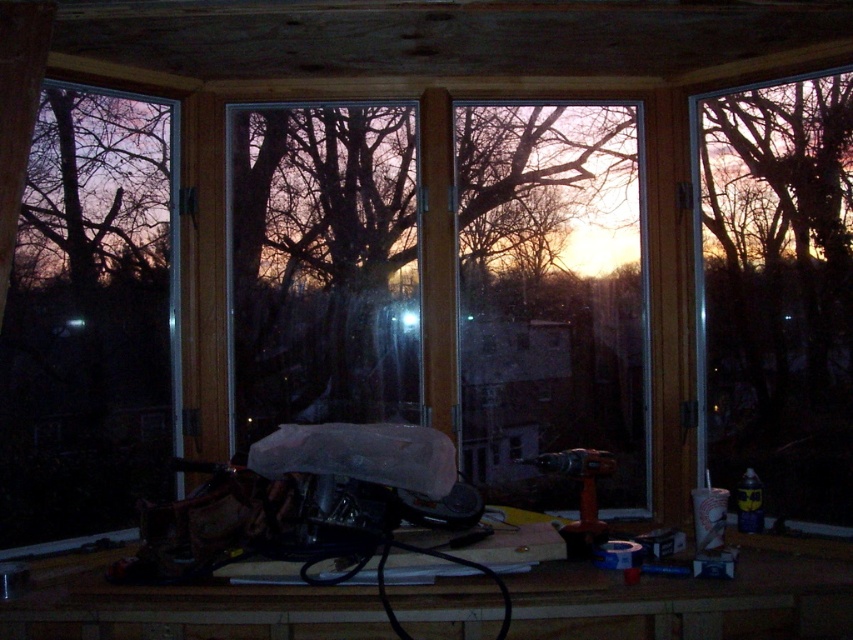
Question: Can you confirm if transparent plastic window at left is positioned below transparent glass window at right?

Choices:
 (A) yes
 (B) no

Answer: (A)

Question: Does transparent glass window at center appear over transparent plastic window at left?

Choices:
 (A) no
 (B) yes

Answer: (B)

Question: Is transparent glass window at center smaller than transparent plastic window at left?

Choices:
 (A) no
 (B) yes

Answer: (B)

Question: Which object is farther from the camera taking this photo?

Choices:
 (A) transparent glass window at center
 (B) transparent plastic window at left
 (C) transparent glass window at right

Answer: (A)

Question: Which of the following is the closest to the observer?

Choices:
 (A) (45, 157)
 (B) (310, 403)

Answer: (A)

Question: Which object is positioned farthest from the transparent glass window at right?

Choices:
 (A) transparent plastic window at left
 (B) transparent glass window at center

Answer: (A)